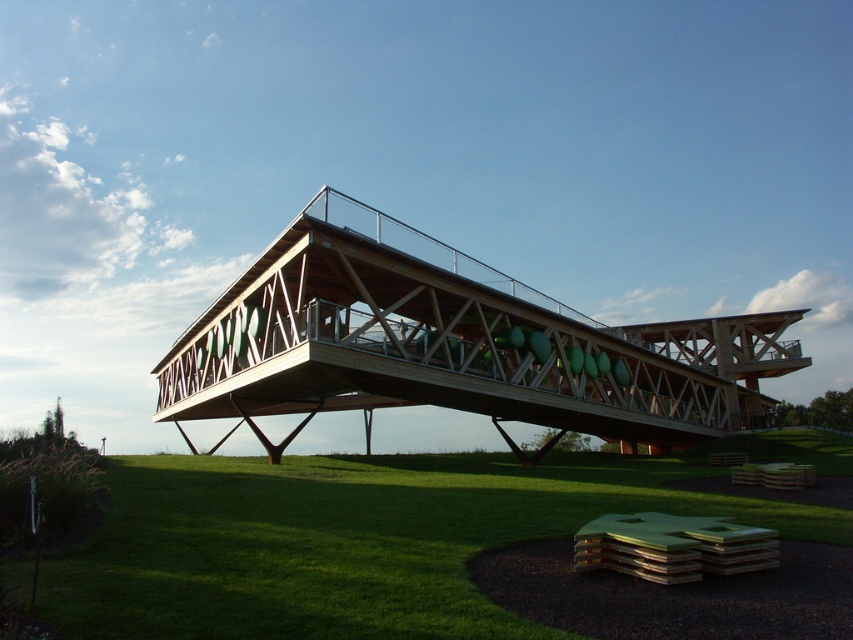
Question: Which object appears closest to the camera in this image?

Choices:
 (A) green grass at lower center
 (B) wooden bridge at center

Answer: (A)

Question: Which of the following is the closest to the observer?

Choices:
 (A) green grass at lower center
 (B) wooden bridge at center

Answer: (A)

Question: Can you confirm if green grass at lower center is positioned below wooden bridge at center?

Choices:
 (A) no
 (B) yes

Answer: (B)

Question: Does green grass at lower center appear on the right side of wooden bridge at center?

Choices:
 (A) yes
 (B) no

Answer: (B)

Question: Observing the image, what is the correct spatial positioning of green grass at lower center in reference to wooden bridge at center?

Choices:
 (A) above
 (B) below

Answer: (B)